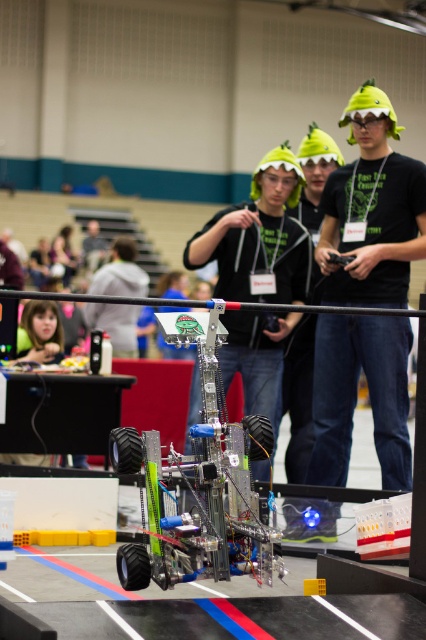
Which of these two, metallic/plastic robot at center or gray fabric shirt at center, stands shorter?

metallic/plastic robot at center

Between metallic/plastic robot at center and gray fabric shirt at center, which one is positioned lower?

metallic/plastic robot at center

Describe the element at coordinates (199, 481) in the screenshot. I see `metallic/plastic robot at center` at that location.

The height and width of the screenshot is (640, 426). What are the coordinates of `metallic/plastic robot at center` in the screenshot? It's located at (199, 481).

Consider the image. Can you confirm if green matte hat at upper center is taller than metallic/plastic robot at center?

Correct, green matte hat at upper center is much taller as metallic/plastic robot at center.

Is point (360, 193) less distant than point (210, 390)?

No.

Who is more distant from viewer, (330,442) or (120,564)?

The point (330,442) is behind.

At what (x,y) coordinates should I click in order to perform the action: click on green matte hat at upper center. Please return your answer as a coordinate pair (x, y). The width and height of the screenshot is (426, 640). Looking at the image, I should click on tap(371, 211).

Who is higher up, green matte hat at upper center or gray fabric shirt at center?

gray fabric shirt at center

Who is positioned more to the left, green matte hat at upper center or gray fabric shirt at center?

gray fabric shirt at center

Is point (359, 90) positioned after point (126, 310)?

No, (359, 90) is in front of (126, 310).

This screenshot has height=640, width=426. I want to click on green matte hat at upper center, so click(x=371, y=211).